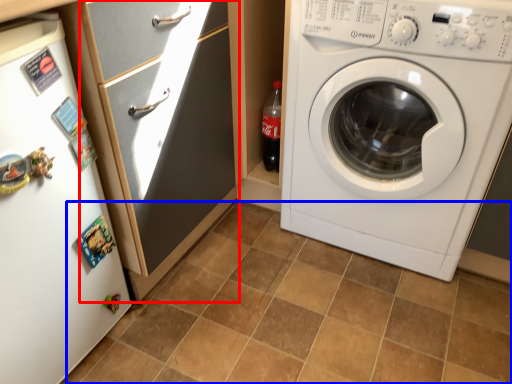
Question: Among these objects, which one is farthest to the camera, screen door (highlighted by a red box) or ceramic tile (highlighted by a blue box)?

Choices:
 (A) screen door
 (B) ceramic tile

Answer: (A)